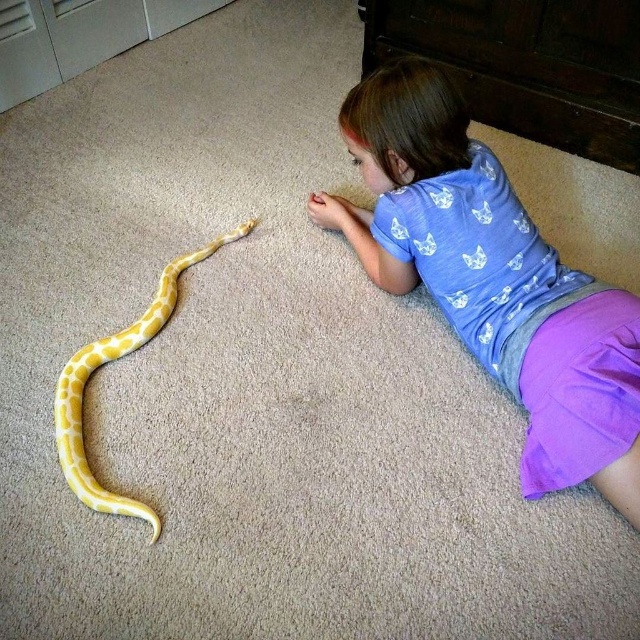
Who is more forward, (502, 177) or (205, 253)?

Positioned in front is point (502, 177).

Consider the image. Who is positioned more to the right, purple cotton shorts at lower right or yellow matte snake at center?

Positioned to the right is purple cotton shorts at lower right.

Which is behind, point (499, 257) or point (83, 387)?

The point (83, 387) is behind.

This screenshot has width=640, height=640. In order to click on purple cotton shorts at lower right in this screenshot , I will do `click(492, 280)`.